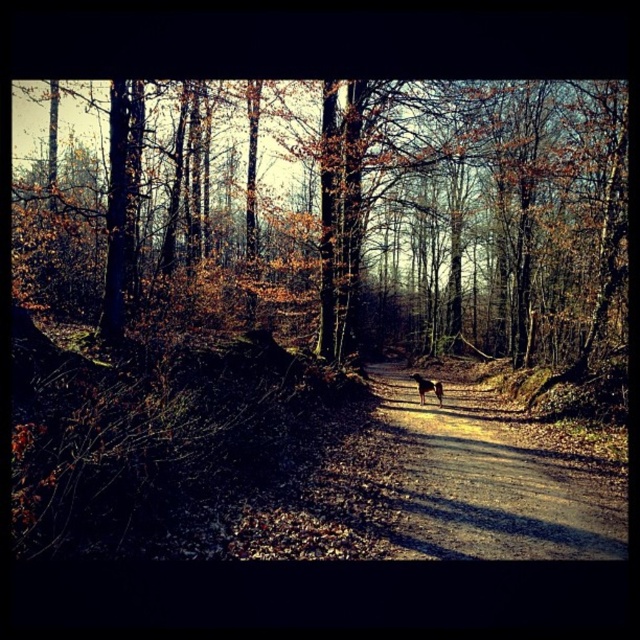
You are a hiker who wants to take your brown fur dog at center with you along the brown dirt path at center. Given that the path is narrow, can you walk together with your dog without feeling cramped? Explain your reasoning.

The brown dirt path at center and brown fur dog at center are 5.33 meters apart from each other. Since the path is narrow, but the distance between them suggests the dog is positioned on the path, there is enough space for both to walk together comfortably.

You are standing on the brown dirt path at center and want to reach the brown bark tree at center. Which direction should you move to get closer to the tree?

The brown bark tree at center is further to the viewer than the brown dirt path at center, so you should move forward along the path to get closer to the tree.

You are a hiker trying to follow the brown dirt path at center through the forest. There is a brown bark tree at center blocking your way. Can you walk around it while staying on the path?

The brown bark tree at center is bigger than the brown dirt path at center, so the path may be too narrow to go around the tree while staying on it. You might need to step off the path to bypass the tree.